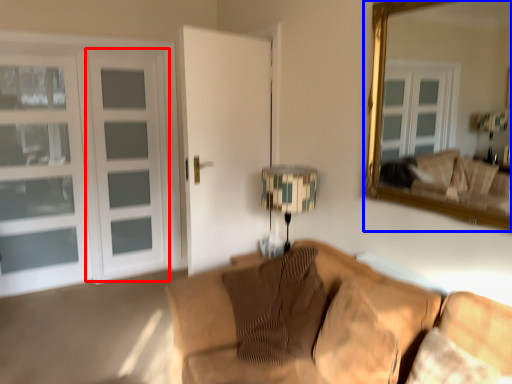
Question: Which point is closer to the camera, screen door (highlighted by a red box) or mirror (highlighted by a blue box)?

Choices:
 (A) screen door
 (B) mirror

Answer: (B)